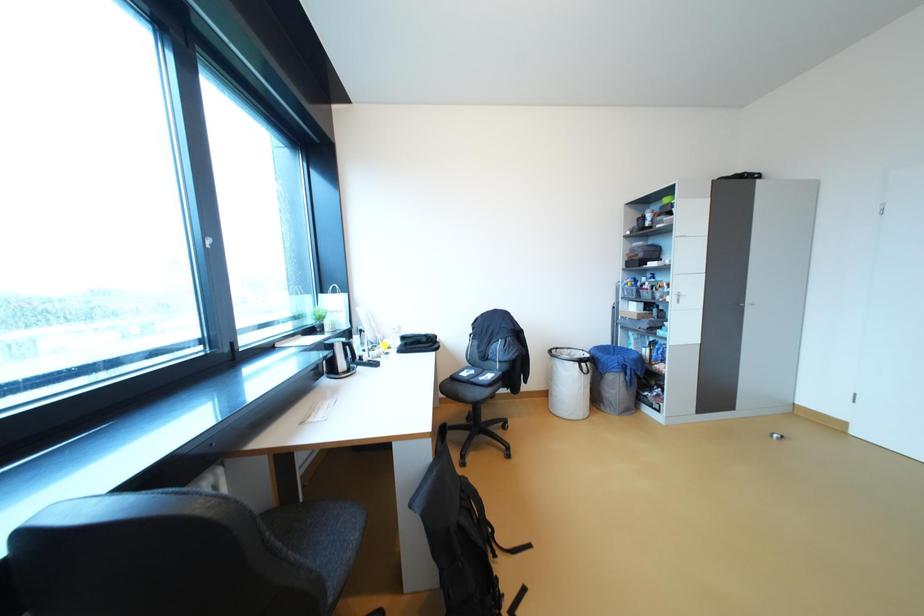
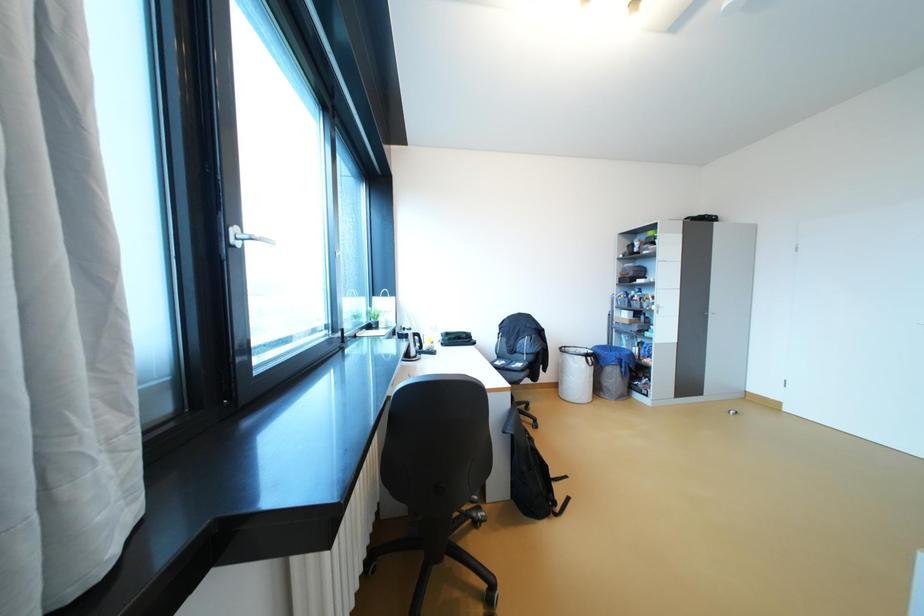
Question: The camera is either moving clockwise (left) or counter-clockwise (right) around the object. The first image is from the beginning of the video and the second image is from the end. Is the camera moving left or right when shooting the video?

Choices:
 (A) Left
 (B) Right

Answer: (A)